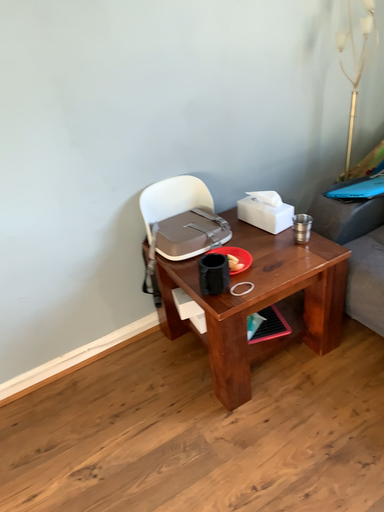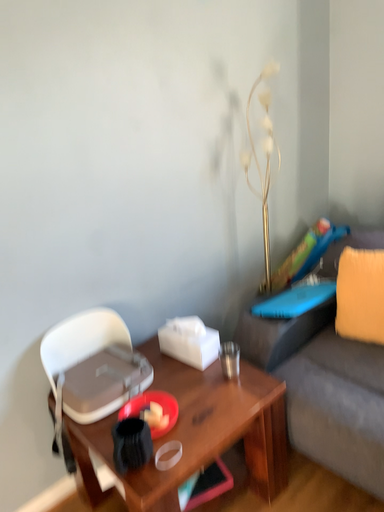
Question: Which way did the camera rotate in the video?

Choices:
 (A) rotated right
 (B) rotated left

Answer: (A)